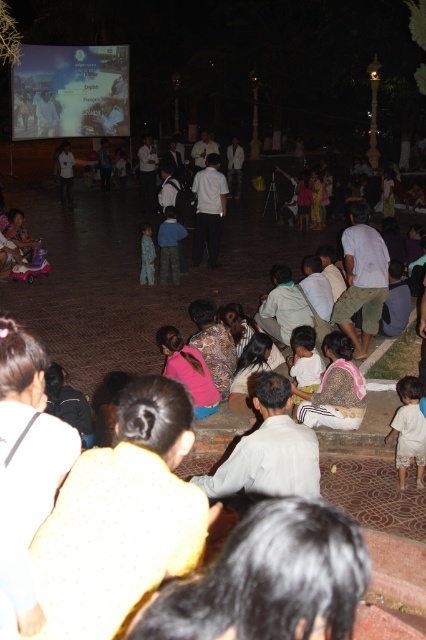
You are a photographer at the event and want to capture both the white cotton shirt at lower right and the white cotton shirt at center in a single photo. However, you notice that focusing on one might blur the other. Which shirt should you focus on to ensure the one closer to you stays sharp?

You should focus on the white cotton shirt at lower right because it is closer to you, so focusing on it will keep it sharp while the background shirt may blur slightly.

You are organizing a clothing donation drive and need to sort shirts by thickness. You have two shirts to evaluate, the white cotton shirt at lower right and the white cotton shirt at center. Which shirt should you place in the section for thinner shirts?

The white cotton shirt at lower right is thinner than the white cotton shirt at center, so it should be placed in the section for thinner shirts.